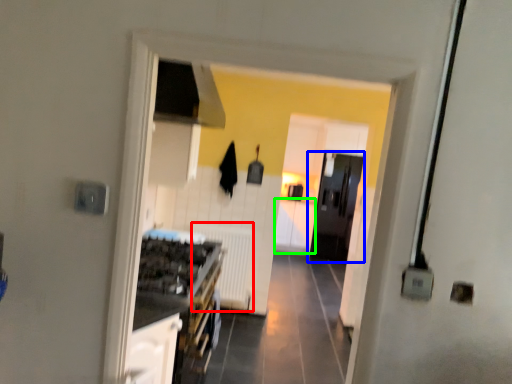
Question: Based on their relative distances, which object is nearer to radiator (highlighted by a red box)? Choose from door (highlighted by a blue box) and cabinetry (highlighted by a green box).

Choices:
 (A) door
 (B) cabinetry

Answer: (A)